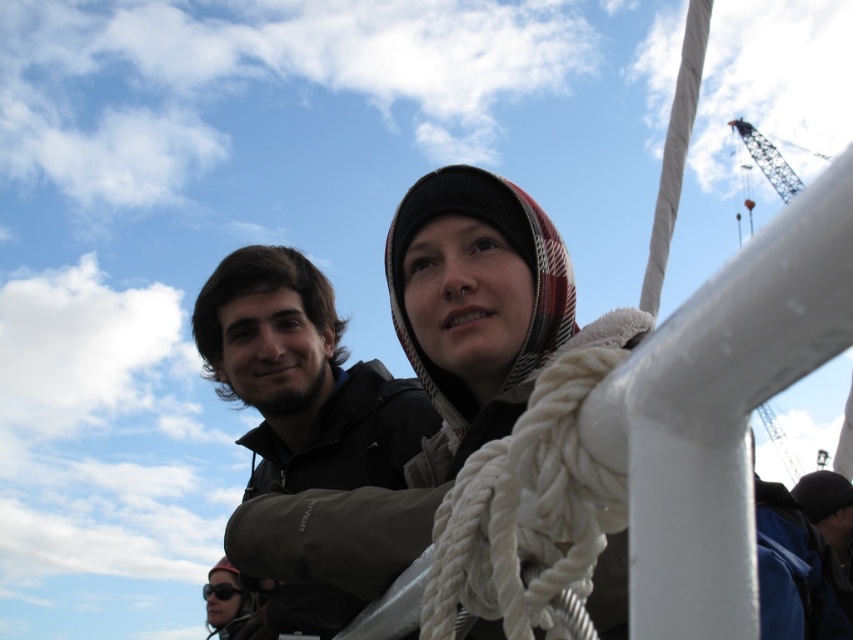
Question: Is plaid woolen hat at upper center wider than dark brown hair at center?

Choices:
 (A) no
 (B) yes

Answer: (A)

Question: Is plaid woolen hat at upper center to the left of dark brown hair at center from the viewer's perspective?

Choices:
 (A) yes
 (B) no

Answer: (B)

Question: Which of the following is the closest to the observer?

Choices:
 (A) dark brown hair at center
 (B) plaid woolen hat at upper center

Answer: (B)

Question: Where is plaid woolen hat at upper center located in relation to dark brown hair at center in the image?

Choices:
 (A) below
 (B) above

Answer: (B)

Question: Which object is farther from the camera taking this photo?

Choices:
 (A) dark brown hair at center
 (B) plaid woolen hat at upper center

Answer: (A)